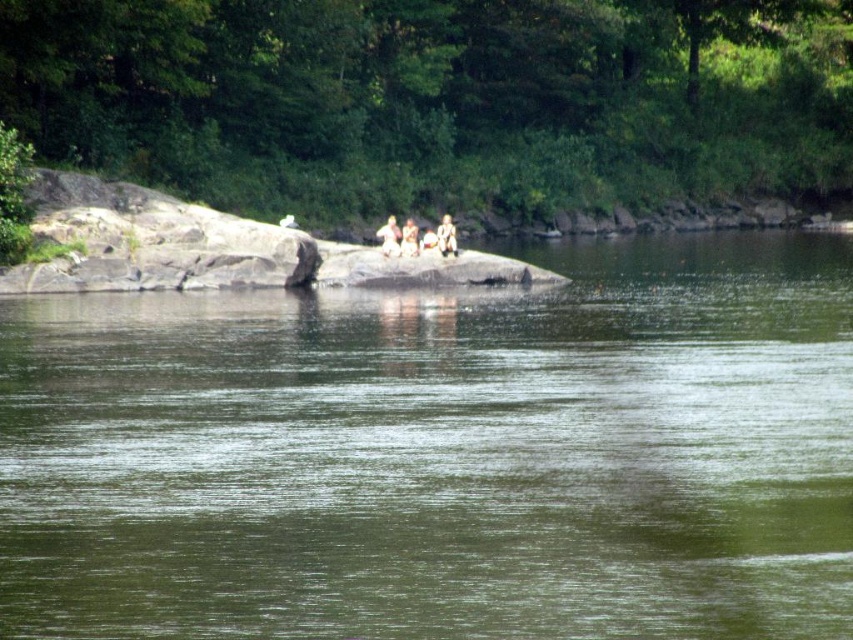
You are planning to place a small picnic basket on the light brown wooden bench at center. However, you notice the green smooth water at center nearby. Is there enough space on the bench to place the basket without it falling into the water?

The green smooth water at center is larger in size than the light brown wooden bench at center. Since the water is larger, the bench might be smaller. However, the exact dimensions of the bench aren not provided, so it is uncertain if the picnic basket will fit without falling into the water. Consider checking the bench size before placing the basket.